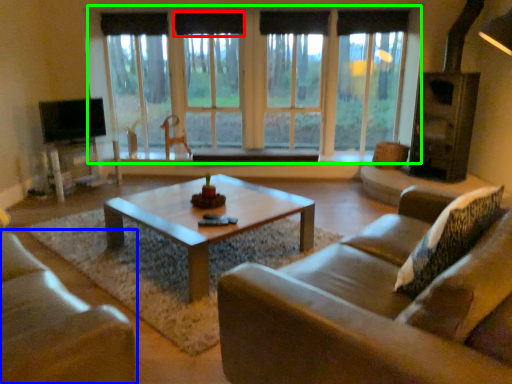
Question: Considering the real-world distances, which object is closest to curtain (highlighted by a red box)? studio couch (highlighted by a blue box) or window (highlighted by a green box).

Choices:
 (A) studio couch
 (B) window

Answer: (B)